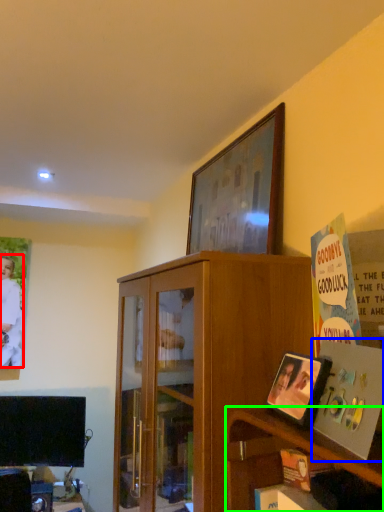
Question: Considering the real-world distances, which object is farthest from person (highlighted by a red box)? paperback book (highlighted by a blue box) or shelf (highlighted by a green box)?

Choices:
 (A) paperback book
 (B) shelf

Answer: (A)